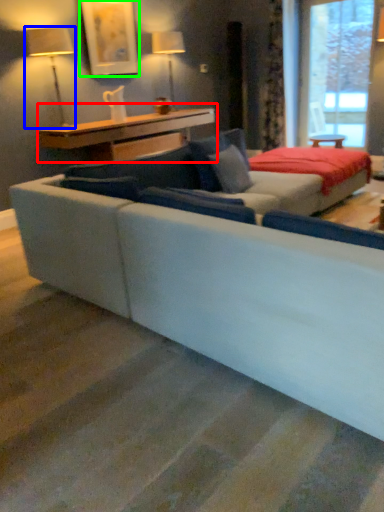
Question: Which is farther away from table (highlighted by a red box)? table lamp (highlighted by a blue box) or picture frame (highlighted by a green box)?

Choices:
 (A) table lamp
 (B) picture frame

Answer: (B)